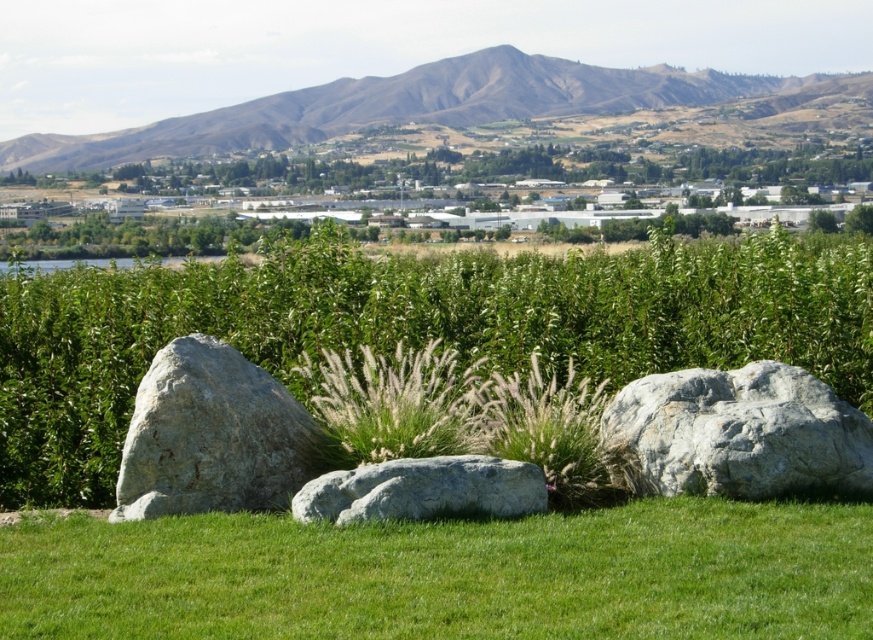
You are standing at point A at the point marked as point (636, 108). You want to walk to point B, which is 75.57 meters away from point A. Can you reach point B within 2 minutes if you walk at a speed of 3 meters per second?

Yes, because walking at 3 meters per second for 2 minutes equals 36 meters per second multiplied by 120 seconds equals 360 meters, which is more than enough to cover the 75.57 meters distance between point A and point B.